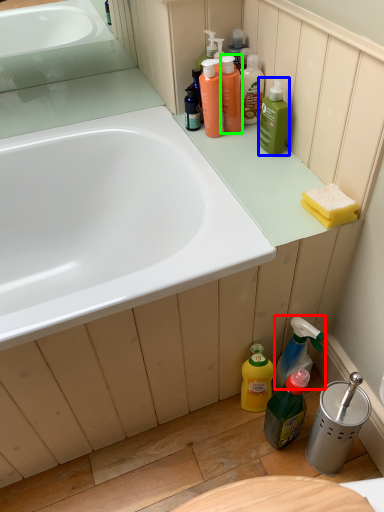
Question: Considering the real-world distances, which object is closest to cleaning product (highlighted by a red box)? cleaning product (highlighted by a blue box) or mouthwash (highlighted by a green box).

Choices:
 (A) cleaning product
 (B) mouthwash

Answer: (A)